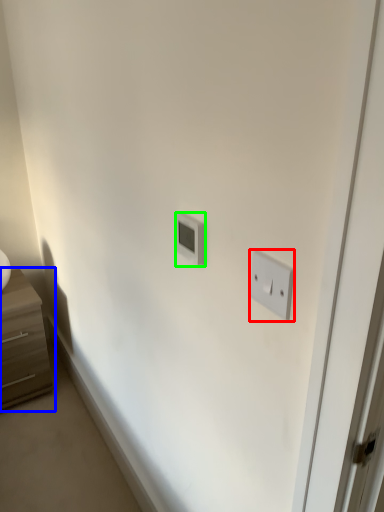
Question: Estimate the real-world distances between objects in this image. Which object is closer to light switch (highlighted by a red box), chest of drawers (highlighted by a blue box) or light switch (highlighted by a green box)?

Choices:
 (A) chest of drawers
 (B) light switch

Answer: (B)